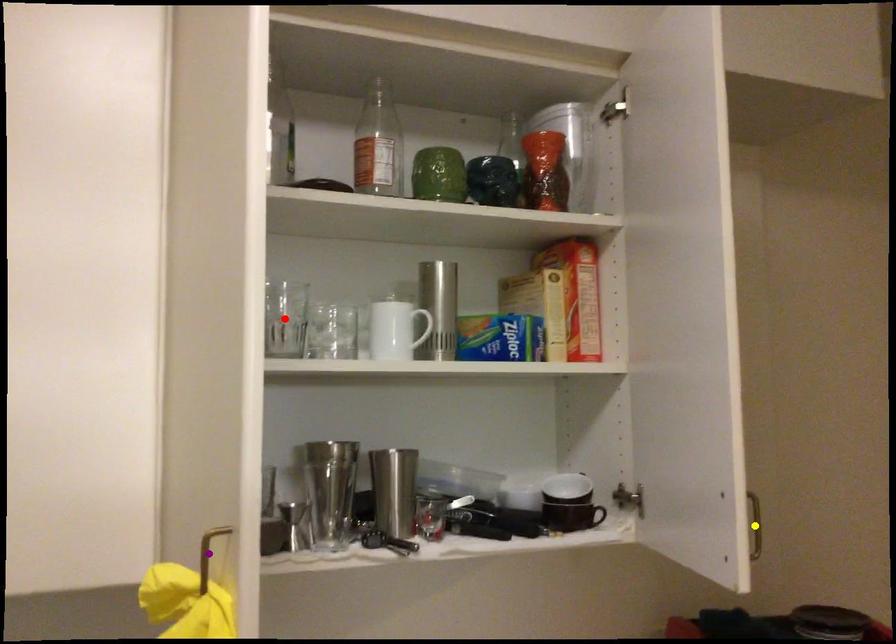
Order these from nearest to farthest:
red point, purple point, yellow point

purple point < red point < yellow point